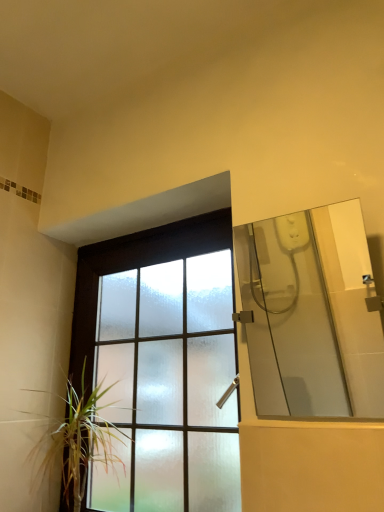
Question: Is transparent glass shower door at right wider or thinner than frosted glass window at center?

Choices:
 (A) wide
 (B) thin

Answer: (B)

Question: Visually, is transparent glass shower door at right positioned to the left or to the right of frosted glass window at center?

Choices:
 (A) right
 (B) left

Answer: (A)

Question: Estimate the real-world distances between objects in this image. Which object is closer to the frosted glass window at center?

Choices:
 (A) green leafy plant at lower left
 (B) transparent glass shower door at right

Answer: (A)

Question: Which object is the closest to the transparent glass shower door at right?

Choices:
 (A) green leafy plant at lower left
 (B) frosted glass window at center

Answer: (B)